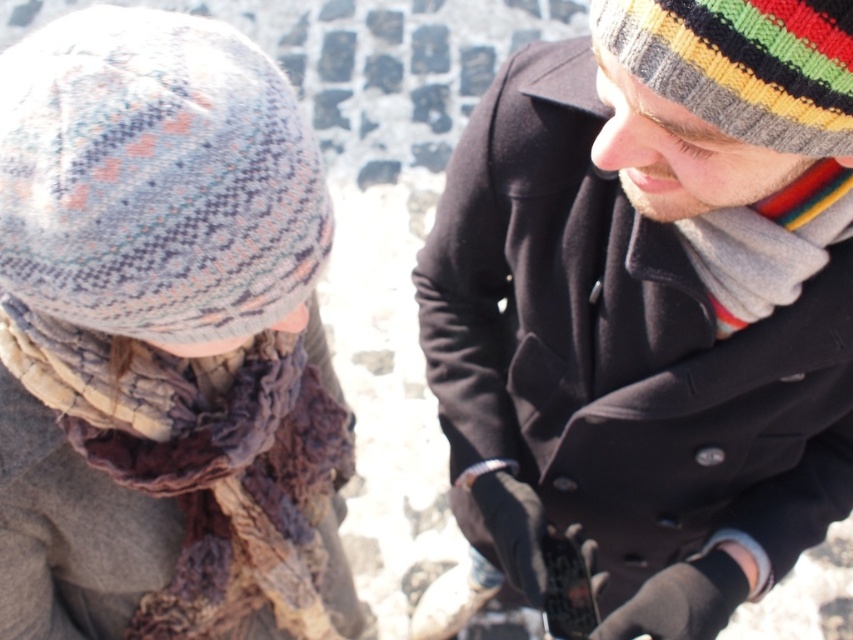
From the picture: Measure the distance from knitted woolen hat at upper left to knitted woolen hat at upper right.

knitted woolen hat at upper left is 38.08 centimeters from knitted woolen hat at upper right.

Based on the photo, does knitted woolen hat at upper left come in front of knitted woolen hat at upper right?

No, knitted woolen hat at upper left is behind knitted woolen hat at upper right.

The height and width of the screenshot is (640, 853). What do you see at coordinates (155, 177) in the screenshot? I see `knitted woolen hat at upper left` at bounding box center [155, 177].

Locate an element on the screen. This screenshot has width=853, height=640. knitted woolen hat at upper left is located at coordinates (155, 177).

Between knitted wool scarf at lower left and gray knitted scarf at right, which one has more height?

Standing taller between the two is knitted wool scarf at lower left.

Identify the location of knitted wool scarf at lower left. (70, 531).

You are a GUI agent. You are given a task and a screenshot of the screen. Output one action in this format:
    pyautogui.click(x=<x>, y=<y>)
    Task: Click on the knitted wool scarf at lower left
    
    Given the screenshot: What is the action you would take?
    pyautogui.click(x=70, y=531)

Can you confirm if knitted woolen hat at upper right is shorter than gray knitted scarf at right?

Yes, knitted woolen hat at upper right is shorter than gray knitted scarf at right.

Which is in front, point (689, 104) or point (711, 228)?

Point (689, 104)

Image resolution: width=853 pixels, height=640 pixels. What do you see at coordinates (743, 65) in the screenshot?
I see `knitted woolen hat at upper right` at bounding box center [743, 65].

The width and height of the screenshot is (853, 640). I want to click on knitted woolen hat at upper right, so click(743, 65).